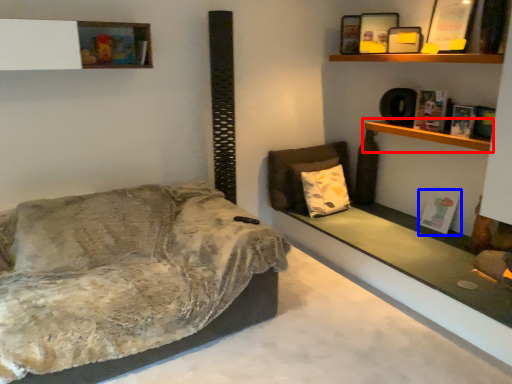
Question: Which of the following is the farthest to the observer, shelf (highlighted by a red box) or book (highlighted by a blue box)?

Choices:
 (A) shelf
 (B) book

Answer: (B)